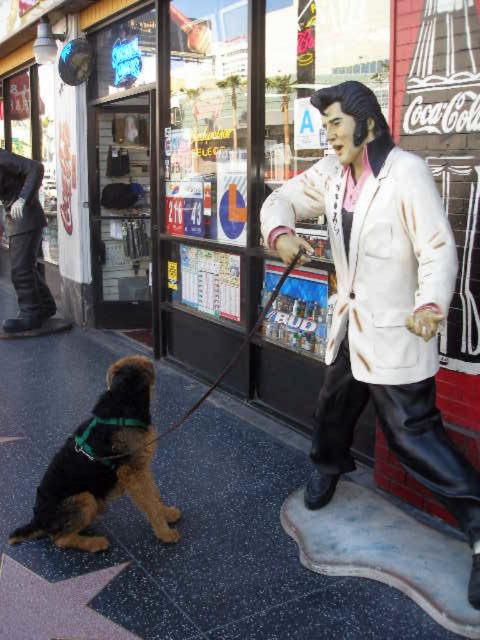
Does brown fuzzy dog at lower left have a larger size compared to black leather pants at left?

Incorrect, brown fuzzy dog at lower left is not larger than black leather pants at left.

Does brown fuzzy dog at lower left come in front of black leather pants at left?

Yes.

What are the coordinates of `brown fuzzy dog at lower left` in the screenshot? It's located at (104, 465).

Does brown fuzzy dog at lower left appear on the right side of metallic star at lower left?

Correct, you'll find brown fuzzy dog at lower left to the right of metallic star at lower left.

Can you confirm if brown fuzzy dog at lower left is taller than metallic star at lower left?

Correct, brown fuzzy dog at lower left is much taller as metallic star at lower left.

The width and height of the screenshot is (480, 640). What do you see at coordinates (104, 465) in the screenshot? I see `brown fuzzy dog at lower left` at bounding box center [104, 465].

Where is `brown fuzzy dog at lower left`? This screenshot has height=640, width=480. brown fuzzy dog at lower left is located at coordinates (104, 465).

Who is more forward, (x=106, y=625) or (x=282, y=275)?

Point (x=106, y=625)

Measure the distance from metallic star at lower left to black leather leash at lower left.

They are 5.31 feet apart.

Identify the location of metallic star at lower left. (54, 604).

Locate an element on the screen. metallic star at lower left is located at coordinates (54, 604).